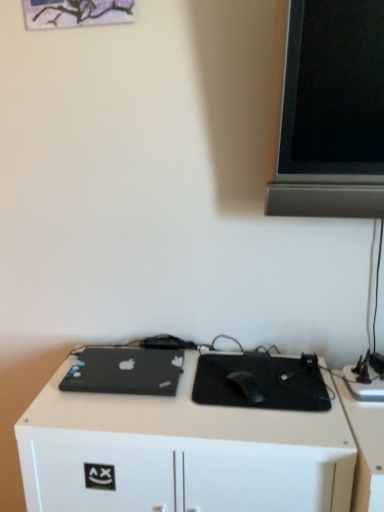
The image size is (384, 512). Find the location of `free point above black matte mousepad at center (from a real-world perspective)`. free point above black matte mousepad at center (from a real-world perspective) is located at coordinates (259, 377).